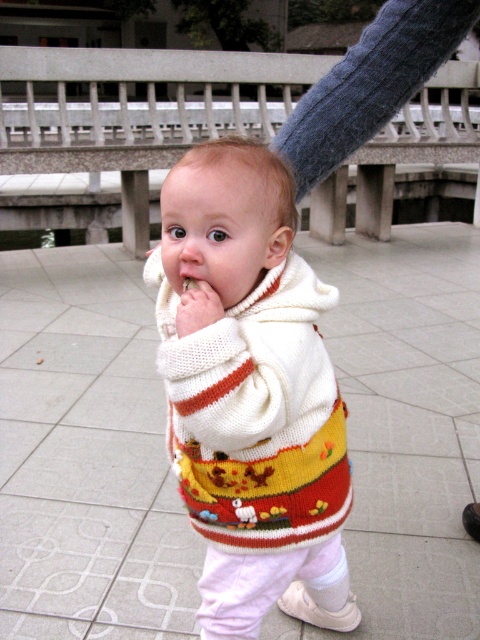
Is point (58, 628) farther from camera compared to point (319, 280)?

No, (58, 628) is in front of (319, 280).

Who is more distant from viewer, (393, 458) or (301, 260)?

The point (393, 458) is more distant.

Is point (136, 390) positioned before point (284, 577)?

No.

Find the location of a particular element. The image size is (480, 640). white tile pavement at center is located at coordinates (86, 456).

Between white tile pavement at center and white knitted hand at center, which one is positioned lower?

white tile pavement at center

How distant is white tile pavement at center from white knitted hand at center?

white tile pavement at center and white knitted hand at center are 2.24 meters apart.

Describe the element at coordinates (86, 456) in the screenshot. I see `white tile pavement at center` at that location.

Identify the location of white tile pavement at center. The height and width of the screenshot is (640, 480). (86, 456).

What do you see at coordinates (252, 394) in the screenshot? I see `white knitted sweater at center` at bounding box center [252, 394].

Is white knitted sweater at center taller than matte white mouth at center?

Yes.

Locate an element on the screen. white knitted sweater at center is located at coordinates (252, 394).

This screenshot has width=480, height=640. In order to click on white knitted sweater at center in this screenshot , I will do `click(252, 394)`.